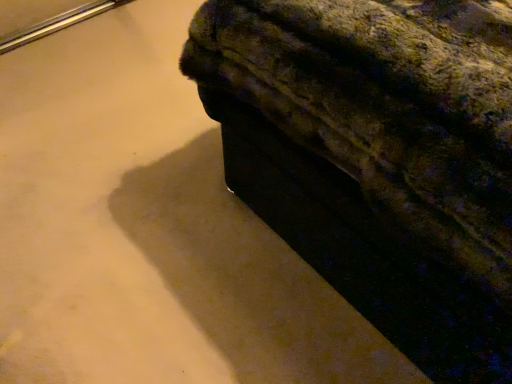
You are a GUI agent. You are given a task and a screenshot of the screen. Output one action in this format:
    pyautogui.click(x=<x>, y=<y>)
    Task: Click on the wooden trunk at upper right
    The width and height of the screenshot is (512, 384).
    Given the screenshot: What is the action you would take?
    pyautogui.click(x=378, y=158)

What is the approximate width of wooden trunk at upper right?

It is 4.84 feet.

What do you see at coordinates (378, 158) in the screenshot? The width and height of the screenshot is (512, 384). I see `wooden trunk at upper right` at bounding box center [378, 158].

Measure the distance between wooden trunk at upper right and camera.

wooden trunk at upper right is 21.14 inches away from camera.

In order to face wooden trunk at upper right, should I rotate leftwards or rightwards?

Rotate your view left by about 13.979°.

Find the location of a particular element. wooden trunk at upper right is located at coordinates (378, 158).